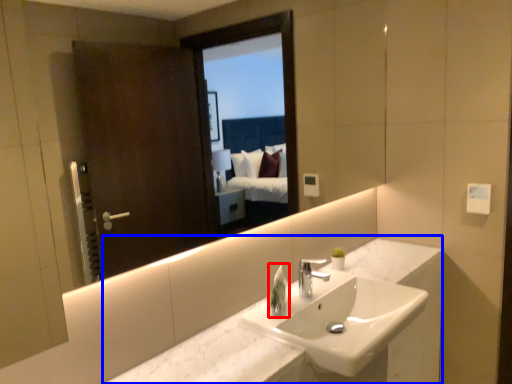
Question: Which object is further to the camera taking this photo, soap dispenser (highlighted by a red box) or counter (highlighted by a blue box)?

Choices:
 (A) soap dispenser
 (B) counter

Answer: (A)